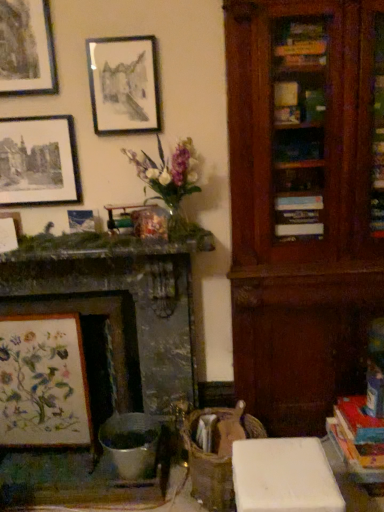
Where is `free space in front of metallic silver picture frame at upper left, the fourth picture frame viewed from the top`? This screenshot has width=384, height=512. free space in front of metallic silver picture frame at upper left, the fourth picture frame viewed from the top is located at coordinates (67, 247).